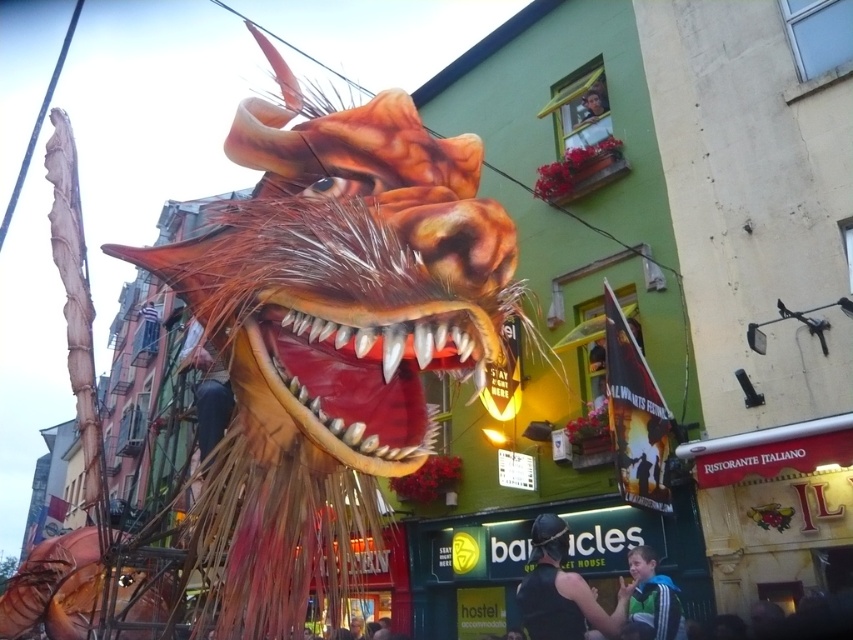
Who is positioned more to the right, shiny metallic dragon head at center or green fabric jacket at lower right?

Positioned to the right is green fabric jacket at lower right.

Which of these two, shiny metallic dragon head at center or green fabric jacket at lower right, stands taller?

shiny metallic dragon head at center

Who is more forward, (346, 170) or (630, 561)?

Positioned in front is point (346, 170).

You are a GUI agent. You are given a task and a screenshot of the screen. Output one action in this format:
    pyautogui.click(x=<x>, y=<y>)
    Task: Click on the shiny metallic dragon head at center
    The width and height of the screenshot is (853, 640).
    Given the screenshot: What is the action you would take?
    pyautogui.click(x=329, y=333)

Is shiny metallic dragon head at center to the left of black leather jacket at center from the viewer's perspective?

Yes, shiny metallic dragon head at center is to the left of black leather jacket at center.

Between point (340, 209) and point (566, 573), which one is positioned in front?

Point (340, 209) is in front.

Which is in front, point (340, 385) or point (527, 632)?

Point (340, 385) is in front.

Locate an element on the screen. This screenshot has width=853, height=640. shiny metallic dragon head at center is located at coordinates (329, 333).

What are the coordinates of `black leather jacket at center` in the screenshot? It's located at (561, 589).

Who is higher up, black leather jacket at center or green fabric jacket at lower right?

black leather jacket at center is above.

Who is more forward, (x=624, y=605) or (x=636, y=586)?

Point (x=624, y=605) is in front.

Image resolution: width=853 pixels, height=640 pixels. Identify the location of black leather jacket at center. (561, 589).